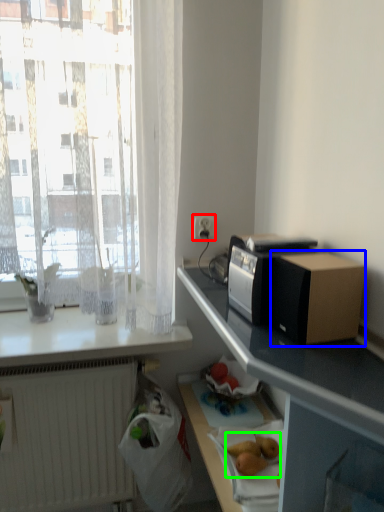
Question: Which object is the closest to the electric outlet (highlighted by a red box)? Choose among these: cardboard box (highlighted by a blue box) or fruit (highlighted by a green box).

Choices:
 (A) cardboard box
 (B) fruit

Answer: (A)